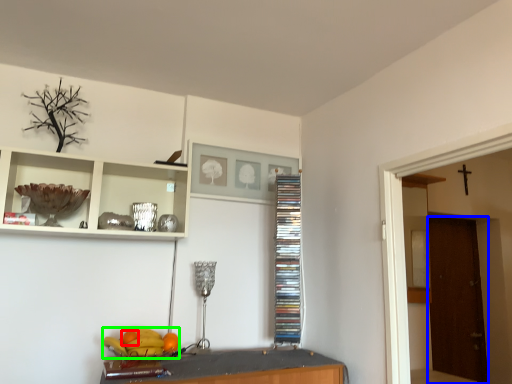
Question: Which object is the closest to the orange (highlighted by a red box)? Choose among these: door (highlighted by a blue box) or fruit (highlighted by a green box).

Choices:
 (A) door
 (B) fruit

Answer: (B)